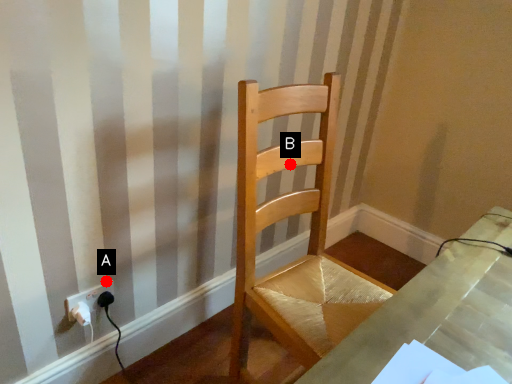
Question: Two points are circled on the image, labeled by A and B beside each circle. Which point is closer to the camera?

Choices:
 (A) A is closer
 (B) B is closer

Answer: (B)